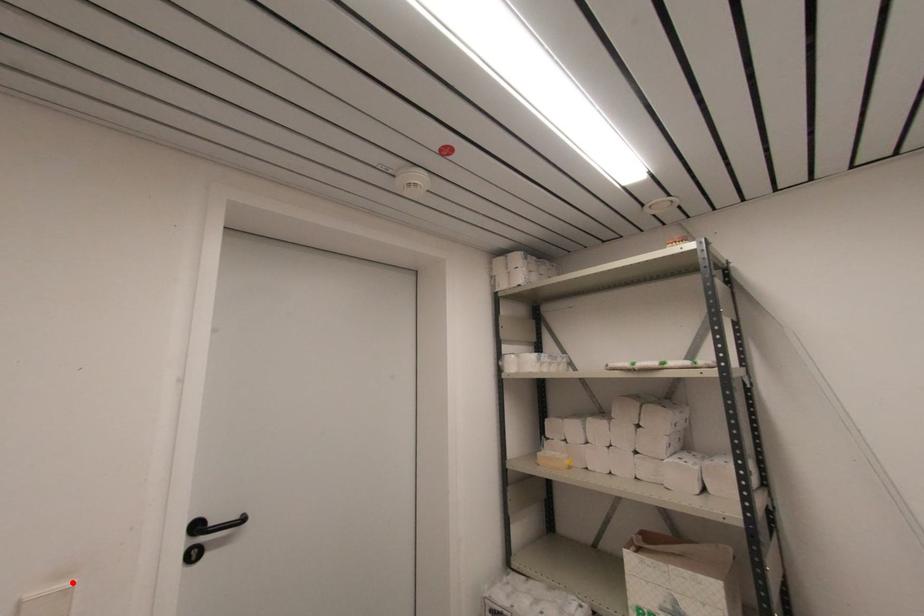
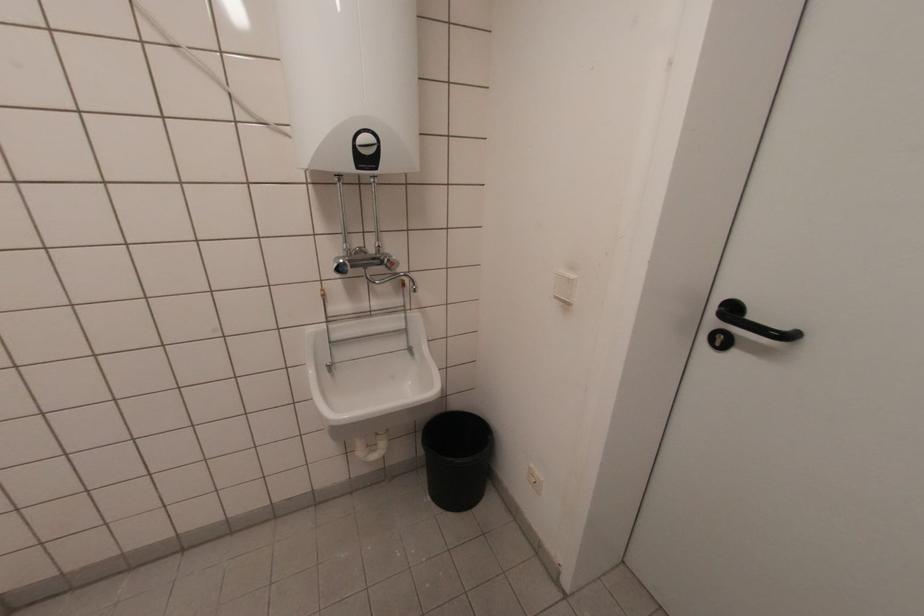
Where in the second image is the point corresponding to the highlighted location from the first image?

(573, 277)